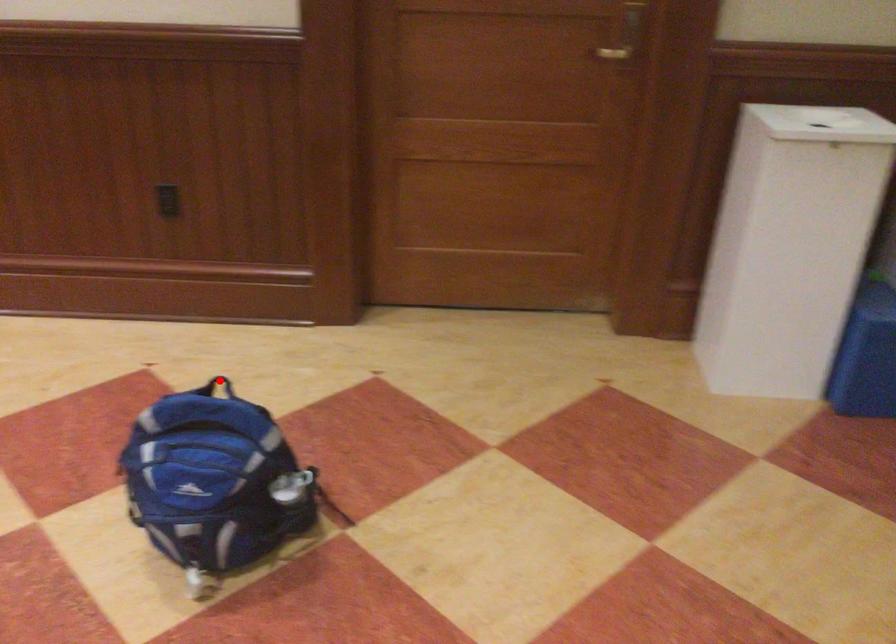
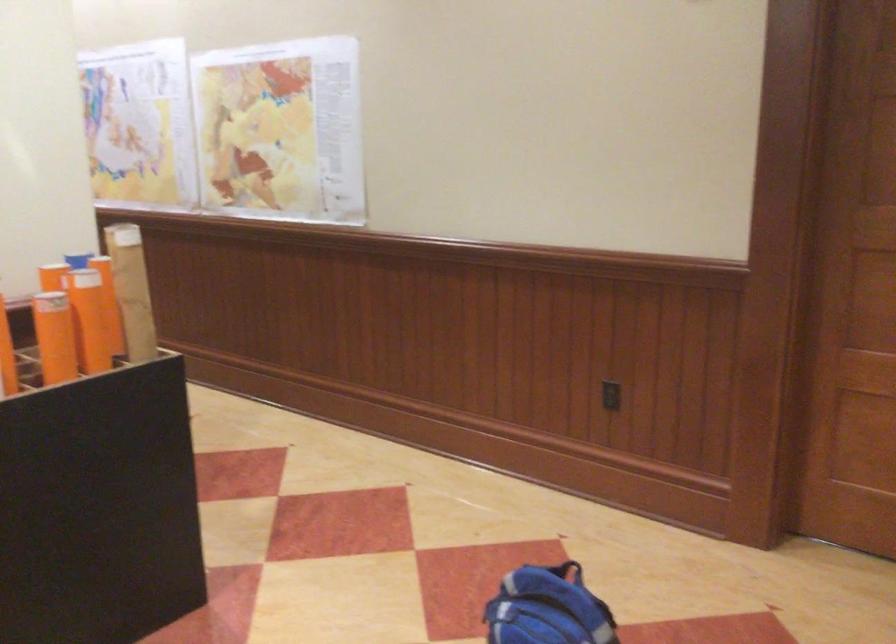
The point at the highlighted location is marked in the first image. Where is the corresponding point in the second image?

(567, 571)